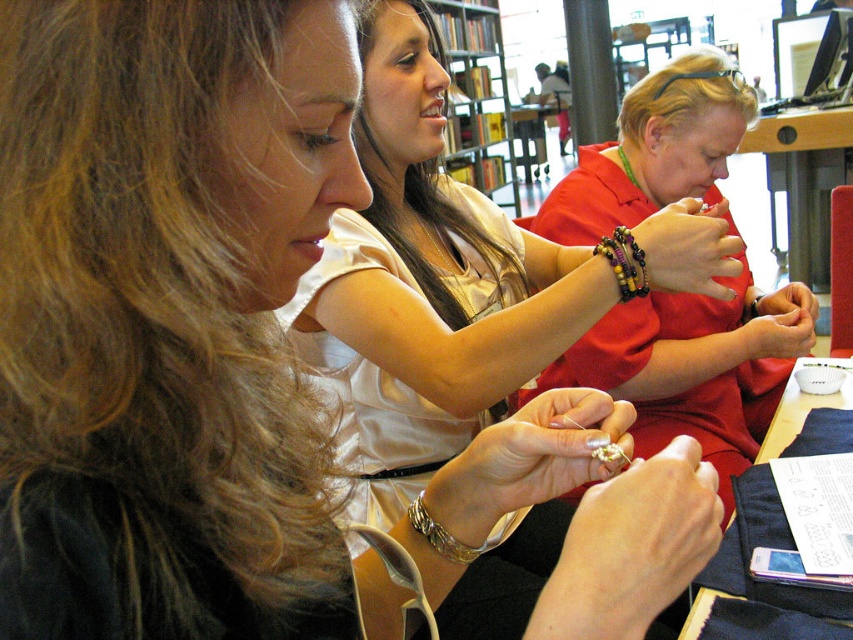
Question: Which point is closer to the camera taking this photo?

Choices:
 (A) coord(425,524)
 (B) coord(631,272)
 (C) coord(759,298)
 (D) coord(495,176)

Answer: (A)

Question: Considering the real-world distances, which object is farthest from the wooden beads bracelet at center?

Choices:
 (A) wooden bookshelf at upper center
 (B) gold metallic bracelet at lower center

Answer: (A)

Question: From the image, what is the correct spatial relationship of matte red blouse at center in relation to gold metallic bracelet at lower center?

Choices:
 (A) above
 (B) below

Answer: (A)

Question: Does matte red blouse at center appear over wooden beads bracelet at center?

Choices:
 (A) yes
 (B) no

Answer: (A)

Question: Is matte red blouse at center bigger than multicolored beaded bracelet at center?

Choices:
 (A) yes
 (B) no

Answer: (A)

Question: Among these objects, which one is nearest to the camera?

Choices:
 (A) gold metallic bracelet at lower center
 (B) wooden beads bracelet at center
 (C) matte red blouse at center

Answer: (A)